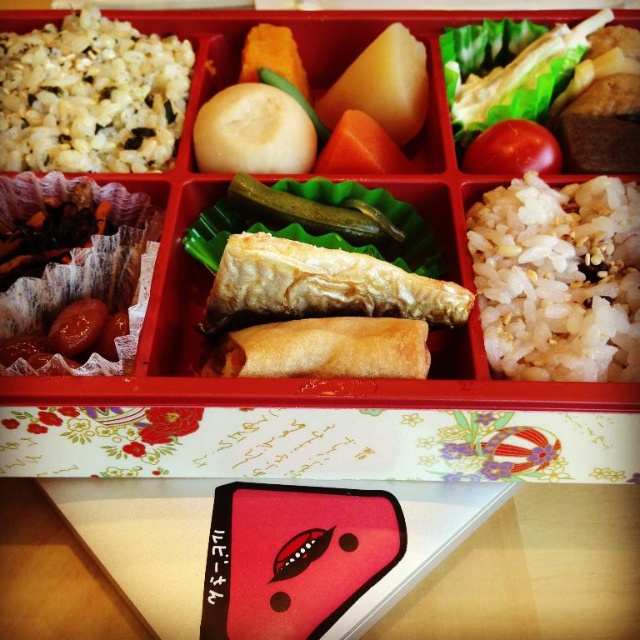
Between point (595, 337) and point (340, 116), which one is positioned behind?

Point (340, 116)

Looking at this image, who is taller, semi-translucent white rice at bottom right or red smooth tomato at center?

Standing taller between the two is semi-translucent white rice at bottom right.

Measure the distance between semi-translucent white rice at bottom right and camera.

86.07 centimeters

You are a GUI agent. You are given a task and a screenshot of the screen. Output one action in this format:
    pyautogui.click(x=<x>, y=<y>)
    Task: Click on the semi-translucent white rice at bottom right
    This screenshot has height=640, width=640.
    Given the screenshot: What is the action you would take?
    pyautogui.click(x=557, y=278)

Between matte red lunch box at center and red matte tomato at upper right, which one is positioned lower?

matte red lunch box at center is below.

Where is `matte red lunch box at center`? The width and height of the screenshot is (640, 640). matte red lunch box at center is located at coordinates (298, 381).

Where is `matte red lunch box at center`? This screenshot has width=640, height=640. matte red lunch box at center is located at coordinates (298, 381).

Where is `red matte tomato at upper right`? This screenshot has height=640, width=640. red matte tomato at upper right is located at coordinates (513, 148).

What do you see at coordinates (513, 148) in the screenshot? The image size is (640, 640). I see `red matte tomato at upper right` at bounding box center [513, 148].

Who is more distant from viewer, (512, 141) or (381, 164)?

The point (381, 164) is behind.

Where is `red matte tomato at upper right`? This screenshot has width=640, height=640. red matte tomato at upper right is located at coordinates (513, 148).